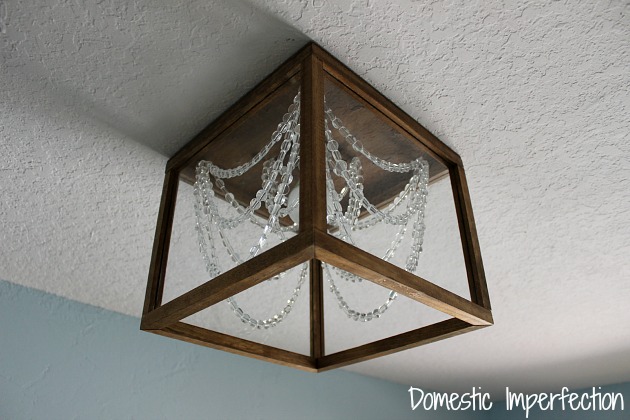
The width and height of the screenshot is (630, 420). Identify the location of lightbulb. (294, 213).